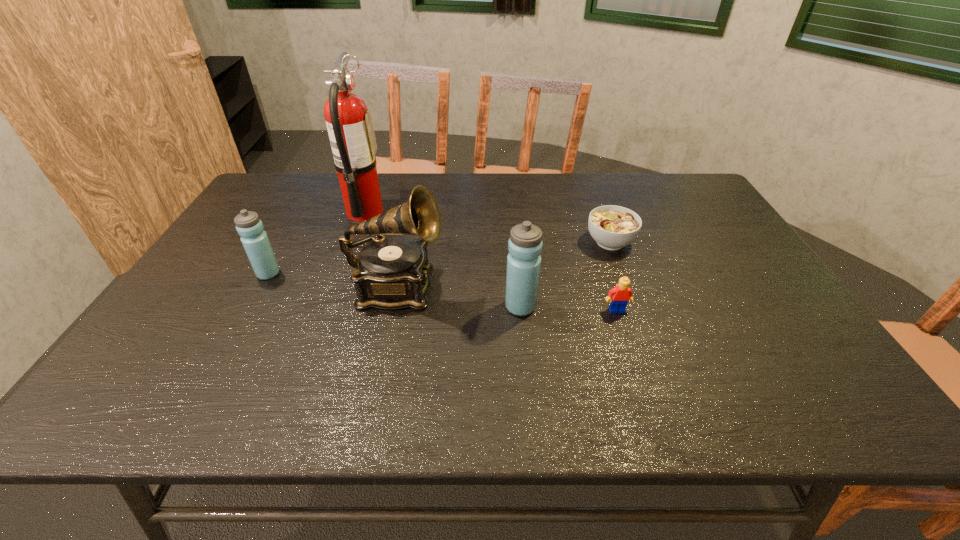
Locate an element on the screen. vacant area situated 0.230m on the back of the soup bowl is located at coordinates (590, 190).

I want to click on free space located on the nozzle side of the fire extinguisher, so click(x=486, y=212).

Where is `vacant space located 0.120m on the face of the fifth tallest object`? vacant space located 0.120m on the face of the fifth tallest object is located at coordinates (631, 352).

Find the location of `free space located on the horn of the phonograph record`. free space located on the horn of the phonograph record is located at coordinates (480, 288).

You are a GUI agent. You are given a task and a screenshot of the screen. Output one action in this format:
    pyautogui.click(x=<x>, y=<y>)
    Task: Click on the object positioned at the far edge
    
    Given the screenshot: What is the action you would take?
    pyautogui.click(x=349, y=123)

Locate an element on the screen. The image size is (960, 540). object that is at the left edge is located at coordinates (255, 241).

This screenshot has width=960, height=540. I want to click on vacant space at the far edge, so click(x=639, y=187).

You are a GUI agent. You are given a task and a screenshot of the screen. Output one action in this format:
    pyautogui.click(x=<x>, y=<y>)
    Task: Click on the free space at the near edge of the desktop
    The width and height of the screenshot is (960, 540).
    Given the screenshot: What is the action you would take?
    pyautogui.click(x=385, y=346)

The width and height of the screenshot is (960, 540). I want to click on vacant space at the right edge, so click(788, 326).

You are a GUI agent. You are given a task and a screenshot of the screen. Output one action in this format:
    pyautogui.click(x=<x>, y=<y>)
    Task: Click on the free region at the far right corner of the desktop
    This screenshot has height=540, width=960.
    Given the screenshot: What is the action you would take?
    pyautogui.click(x=676, y=183)